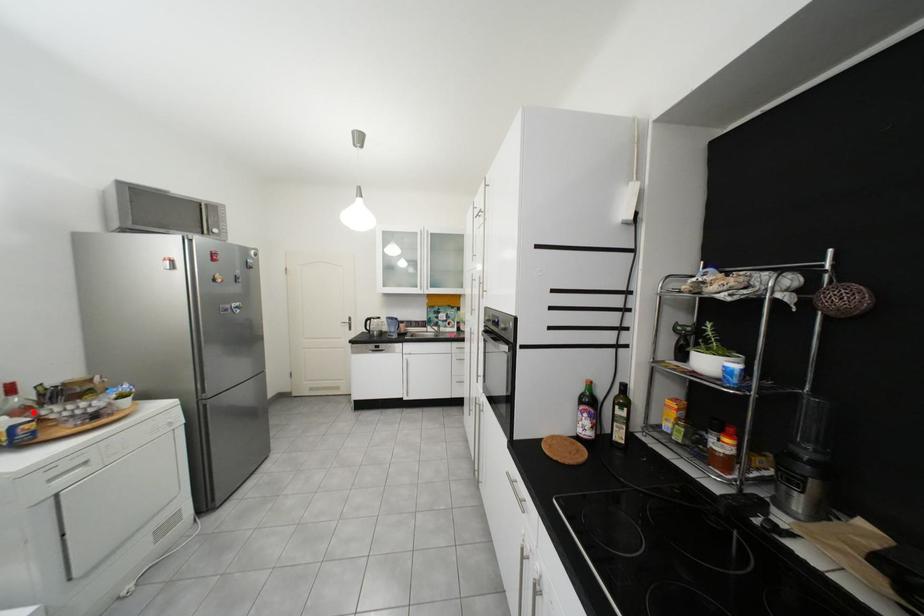
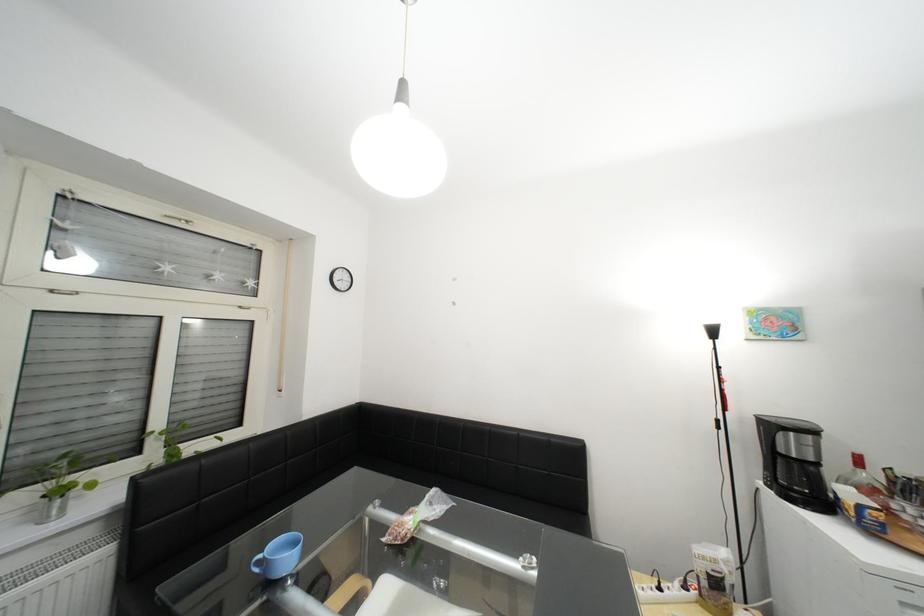
Locate, in the second image, the point that corresponds to the highlighted location in the first image.

(881, 492)